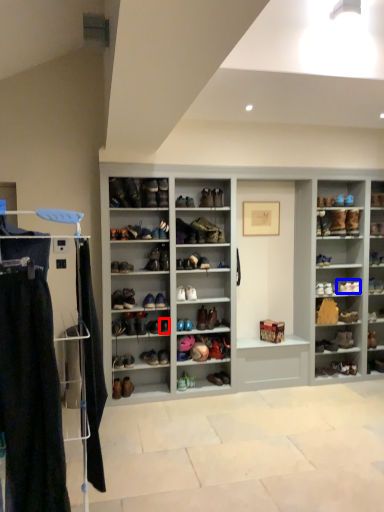
Question: Which point is closer to the camera, shoe (highlighted by a red box) or shoe (highlighted by a blue box)?

Choices:
 (A) shoe
 (B) shoe

Answer: (A)